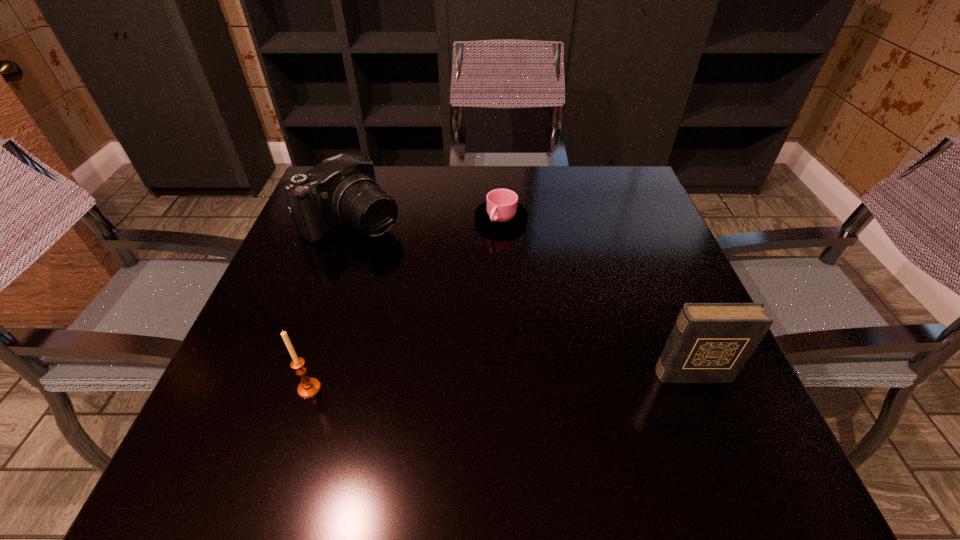
Locate an element on the screen. The height and width of the screenshot is (540, 960). vacant space that is in between the camera and the third object from left to right is located at coordinates (427, 221).

Locate an element on the screen. This screenshot has width=960, height=540. free space between the camera and the diary is located at coordinates (522, 298).

Where is `unoccupied position between the cup and the rightmost object`? unoccupied position between the cup and the rightmost object is located at coordinates (596, 297).

This screenshot has width=960, height=540. What are the coordinates of `vacant space that's between the candle_holder and the camera` in the screenshot? It's located at (331, 305).

The width and height of the screenshot is (960, 540). I want to click on vacant point located between the camera and the rightmost object, so click(x=522, y=298).

Locate an element on the screen. The image size is (960, 540). vacant area that lies between the cup and the diary is located at coordinates (596, 297).

This screenshot has height=540, width=960. In order to click on empty space that is in between the camera and the cup in this screenshot , I will do `click(427, 221)`.

Locate an element on the screen. Image resolution: width=960 pixels, height=540 pixels. free space between the camera and the candle_holder is located at coordinates (331, 305).

Identify the location of the second closest object to the candle_holder. (501, 212).

Identify which object is the third closest to the diary. Please provide its 2D coordinates. Your answer should be formatted as a tuple, i.e. [(x, y)], where the tuple contains the x and y coordinates of a point satisfying the conditions above.

[(342, 189)]